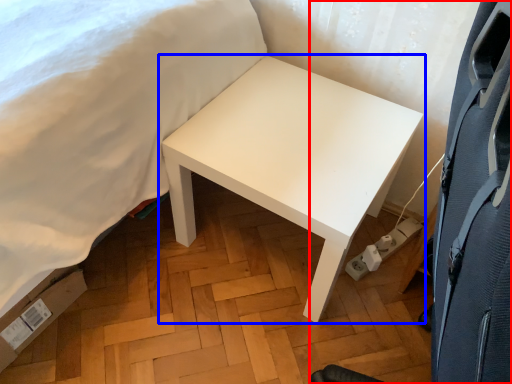
Question: Which of the following is the farthest to the observer, swivel chair (highlighted by a red box) or table (highlighted by a blue box)?

Choices:
 (A) swivel chair
 (B) table

Answer: (B)